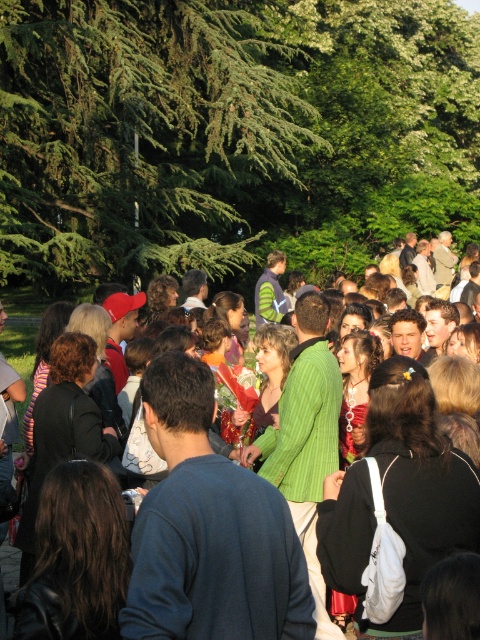
You are a photographer at this event and want to capture both the green leafy tree at upper left and the green textured sweater at center in a single frame. Which object should you focus on first to ensure both are in the shot?

The green leafy tree at upper left is larger in size than the green textured sweater at center, so you should focus on the green leafy tree at upper left first to ensure both are in the shot.

Consider the image. You are at the park and want to take a photo of the green leafy tree at upper left and the green textured sweater at center. Which object should you frame first in your camera viewfinder to ensure both are in the shot?

You should frame the green leafy tree at upper left first since it is positioned to the left of the green textured sweater at center, allowing both to be captured in the same frame.